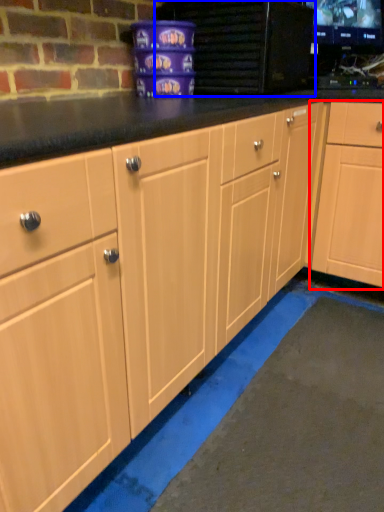
Question: Which point is closer to the camera, cabinetry (highlighted by a red box) or appliance (highlighted by a blue box)?

Choices:
 (A) cabinetry
 (B) appliance

Answer: (B)